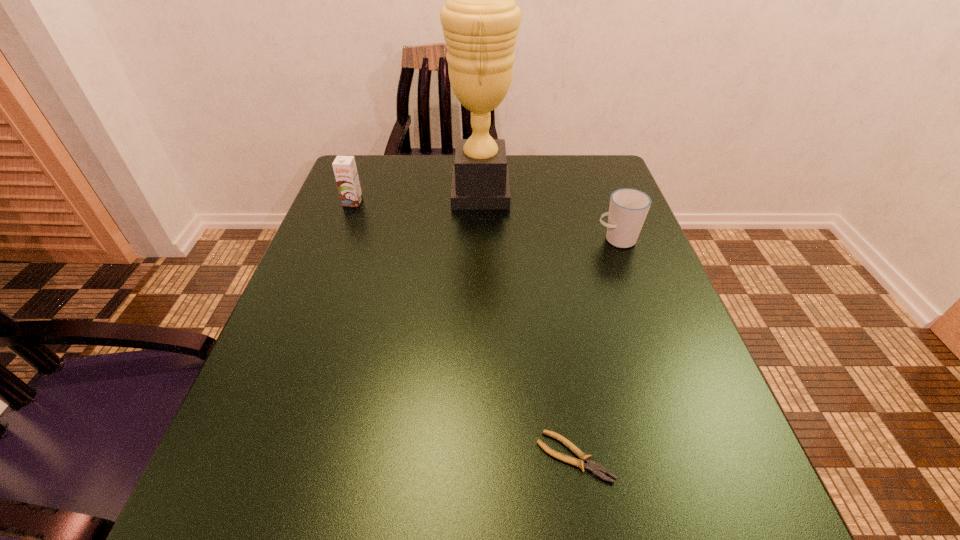
Locate an element on the screen. This screenshot has height=540, width=960. free space between the second object from right to left and the second nearest object is located at coordinates (595, 348).

Locate an element on the screen. Image resolution: width=960 pixels, height=540 pixels. vacant area that lies between the chocolate milk and the shortest object is located at coordinates (464, 329).

Identify the location of empty space between the tallest object and the pliers. (527, 325).

Locate an element on the screen. The image size is (960, 540). empty space that is in between the shortest object and the trophy cup is located at coordinates (527, 325).

Where is `free spot between the third object from left to right and the leftmost object`? free spot between the third object from left to right and the leftmost object is located at coordinates (464, 329).

Find the location of a particular element. The height and width of the screenshot is (540, 960). free spot between the third farthest object and the pliers is located at coordinates (595, 348).

Identify which object is located as the nearest to the chocolate milk. Please provide its 2D coordinates. Your answer should be formatted as a tuple, i.e. [(x, y)], where the tuple contains the x and y coordinates of a point satisfying the conditions above.

[(480, 19)]

Identify the location of object that is the nearest to the leftmost object. (480, 19).

Find the location of a particular element. vacant space that satisfies the following two spatial constraints: 1. at the front of the tallest object with handles; 2. on the front side of the chocolate milk is located at coordinates (481, 202).